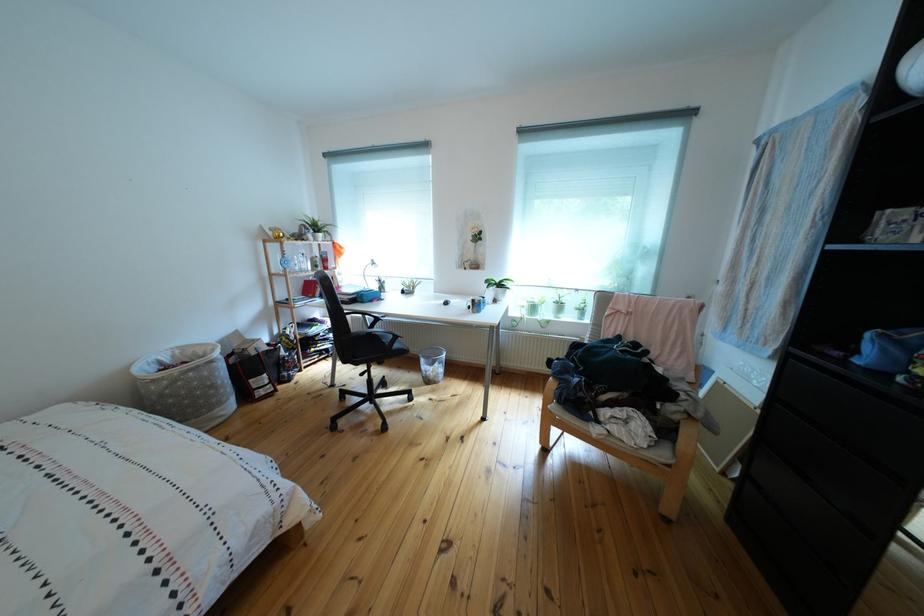
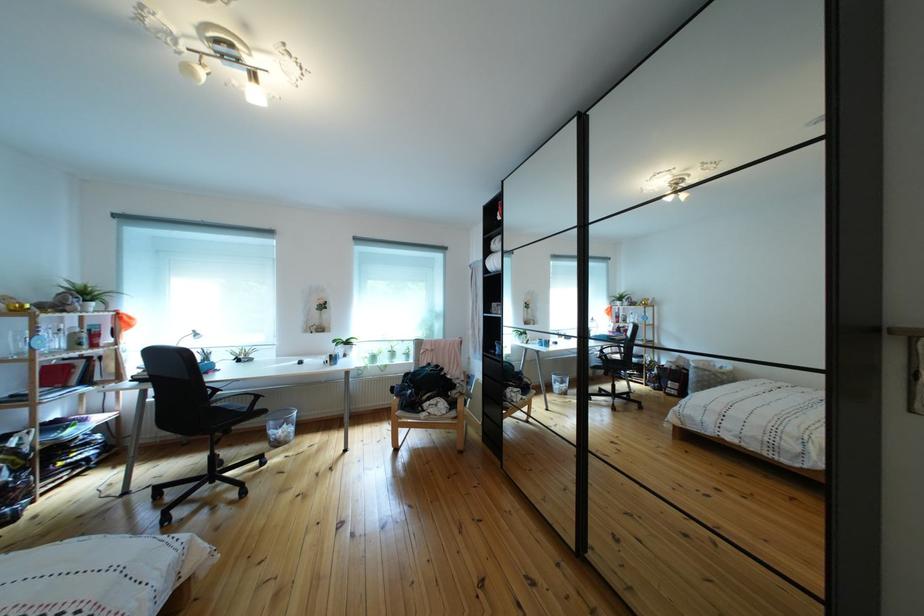
Where in the second image is the point corresponding to pixel 696 402 from the first image?

(469, 391)